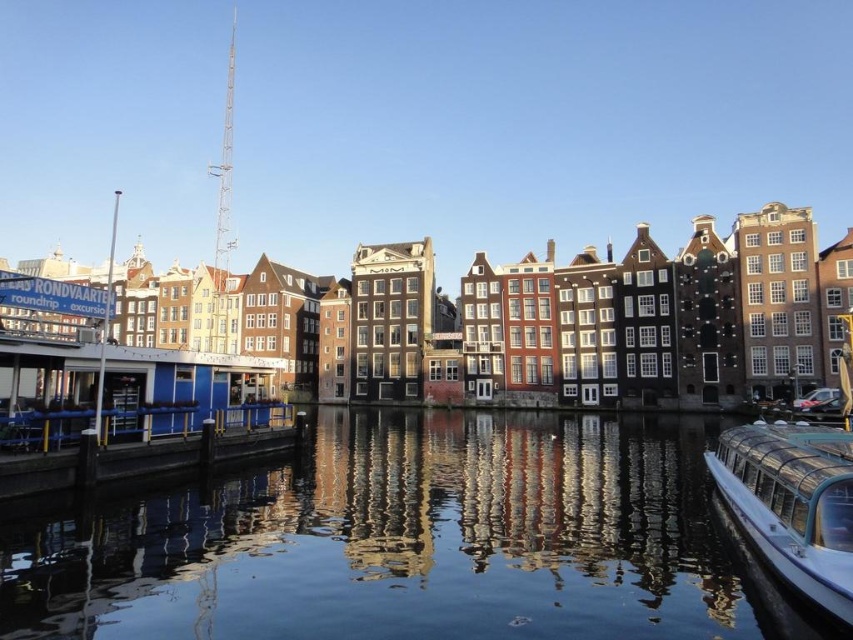
You are standing on the smooth wooden dock at lower left and want to see the transparent glass water at center. In which direction should you look?

You should look downward toward the transparent glass water at center, as it is located below the smooth wooden dock at lower left.

You are standing at the point marked as point (x=415, y=541) in the canal scene. What do you see directly in front of you?

You see transparent glass water at center directly in front of you, as the point marks this location.